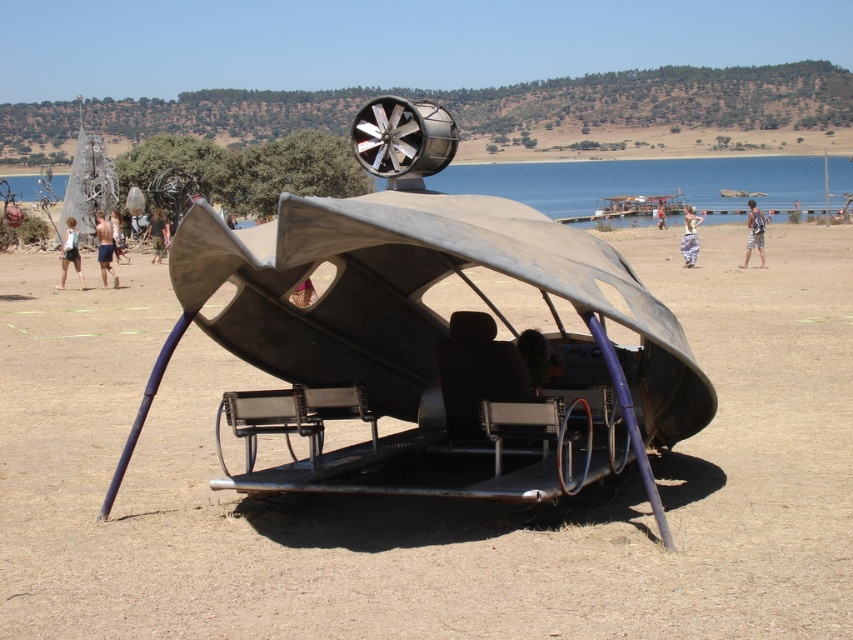
Who is lower down, brown dirt field at center or skinny man at left?

Positioned lower is brown dirt field at center.

Can you confirm if brown dirt field at center is bigger than skinny man at left?

Correct, brown dirt field at center is larger in size than skinny man at left.

What do you see at coordinates (430, 499) in the screenshot?
I see `brown dirt field at center` at bounding box center [430, 499].

Where is `brown dirt field at center`? brown dirt field at center is located at coordinates (430, 499).

Which of these two, white cotton shorts at lower left or camouflage fabric person at center, stands taller?

Result: With more height is white cotton shorts at lower left.

Looking at this image, can you confirm if white cotton shorts at lower left is thinner than camouflage fabric person at center?

In fact, white cotton shorts at lower left might be wider than camouflage fabric person at center.

Is point (62, 285) less distant than point (154, 252)?

Yes, it is in front of point (154, 252).

What are the coordinates of `white cotton shorts at lower left` in the screenshot? It's located at (70, 253).

Is point (99, 225) closer to viewer compared to point (64, 275)?

No, it is behind (64, 275).

Who is higher up, skinny man at left or white cotton shorts at lower left?

Positioned higher is skinny man at left.

Locate an element on the screen. This screenshot has height=640, width=853. skinny man at left is located at coordinates (103, 248).